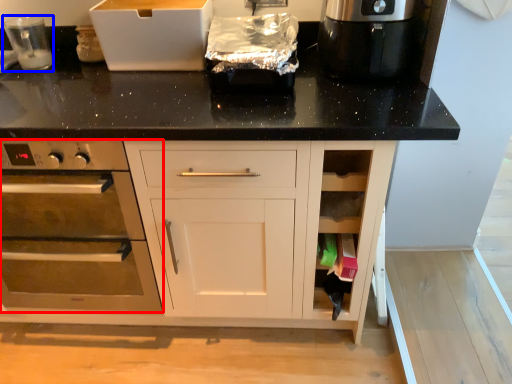
Question: Which of the following is the closest to the observer, home appliance (highlighted by a red box) or appliance (highlighted by a blue box)?

Choices:
 (A) home appliance
 (B) appliance

Answer: (A)